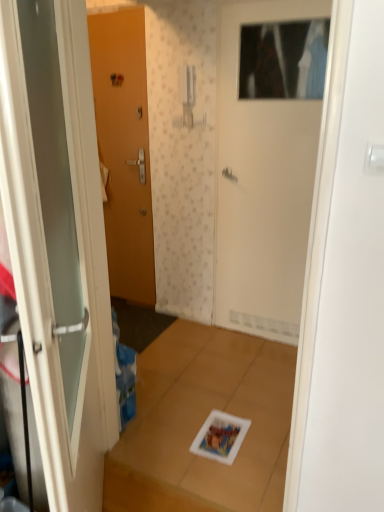
Where is `vacant space underneath white matte door at upper center, the 2th door positioned from the front (from a real-world perspective)`? vacant space underneath white matte door at upper center, the 2th door positioned from the front (from a real-world perspective) is located at coordinates (259, 338).